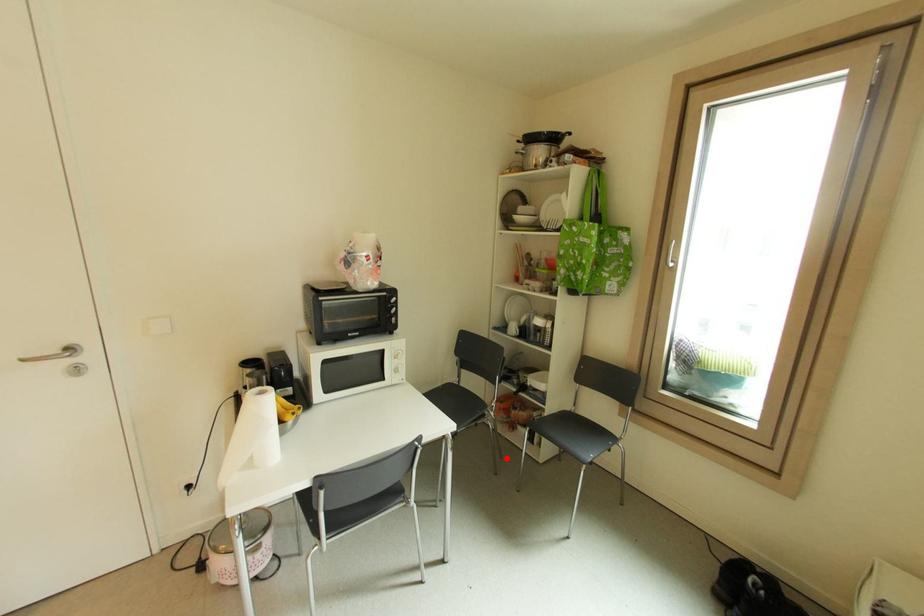
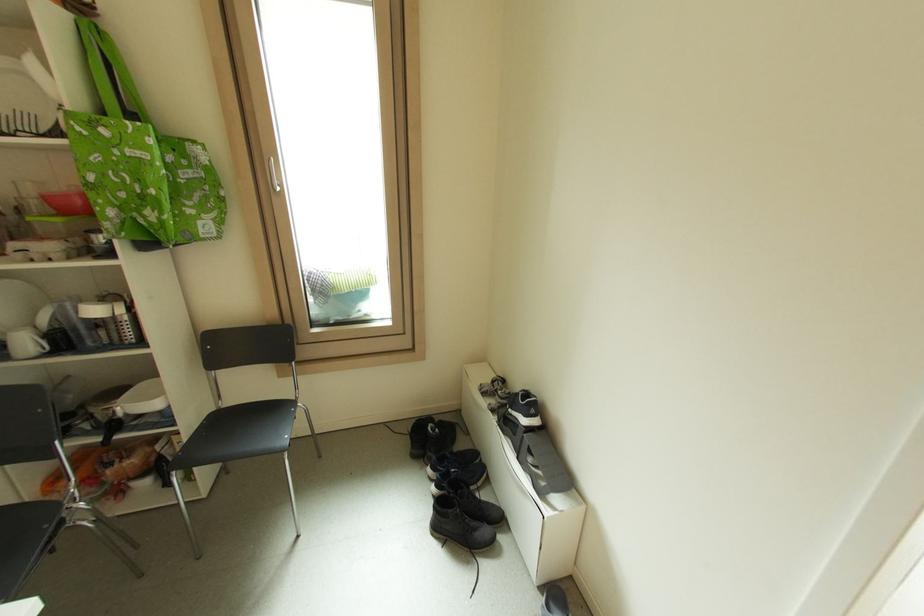
Question: I am providing you with two images of the same scene from different viewpoints. Given a red point in image1, look at the same physical point in image2. Is it:

Choices:
 (A) Closer to the viewpoint
 (B) Farther from the viewpoint

Answer: (B)